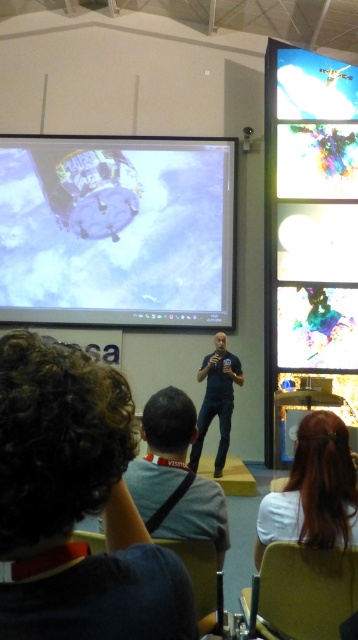
You are a stagehand who needs to move a 2.0 meter long ladder from the back of the stage to the front. The ladder must pass between the speaker and the point at (267, 512). Can the ladder fit through this space?

The distance between the speaker and the point at (267, 512) is 1.85 meters, which is less than the ladder length of 2.0 meters. Therefore, the ladder cannot fit through the space between them.

You are an attendee at the presentation. You are currently sitting in the audience and see the shiny metallic display at right and the blue denim jeans at center. Which object is positioned to the right of the other?

The shiny metallic display at right is to the right of the blue denim jeans at center.